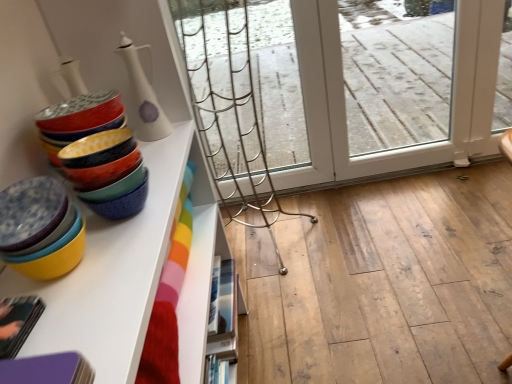
Question: Is white glossy vase at upper left, which ranks as the first tableware in top-to-bottom order, aimed at white glossy bookshelf at lower center?

Choices:
 (A) no
 (B) yes

Answer: (A)

Question: Does white glossy vase at upper left, which ranks as the first tableware in top-to-bottom order, have a larger size compared to white glossy bookshelf at lower center?

Choices:
 (A) yes
 (B) no

Answer: (B)

Question: From a real-world perspective, does white glossy vase at upper left, the 2th tableware when ordered from bottom to top, sit lower than white glossy bookshelf at lower center?

Choices:
 (A) yes
 (B) no

Answer: (B)

Question: Would you say white glossy bookshelf at lower center is part of white glossy vase at upper left, the 2th tableware when ordered from bottom to top,'s contents?

Choices:
 (A) no
 (B) yes

Answer: (A)

Question: From the image's perspective, does white glossy vase at upper left, which ranks as the first tableware in top-to-bottom order, appear higher than white glossy bookshelf at lower center?

Choices:
 (A) no
 (B) yes

Answer: (B)

Question: Considering the positions of matte ceramic bowls at left, which appears as the 2th tableware when viewed from the top, and matte ceramic bowls at left in the image, is matte ceramic bowls at left, which appears as the 2th tableware when viewed from the top, wider or thinner than matte ceramic bowls at left?

Choices:
 (A) wide
 (B) thin

Answer: (A)

Question: From their relative heights in the image, would you say matte ceramic bowls at left, which appears as the 2th tableware when viewed from the top, is taller or shorter than matte ceramic bowls at left?

Choices:
 (A) tall
 (B) short

Answer: (A)

Question: Which is correct: matte ceramic bowls at left, which appears as the 2th tableware when viewed from the top, is inside matte ceramic bowls at left, or outside of it?

Choices:
 (A) outside
 (B) inside

Answer: (A)

Question: In the image, is matte ceramic bowls at left, positioned as the second tableware in back-to-front order, on the left side or the right side of matte ceramic bowls at left?

Choices:
 (A) right
 (B) left

Answer: (A)

Question: From a real-world perspective, is matte ceramic bowls at left, positioned as the second tableware in back-to-front order, positioned above or below white glossy vase at upper left, which ranks as the first tableware in top-to-bottom order?

Choices:
 (A) below
 (B) above

Answer: (A)

Question: From the image's perspective, is matte ceramic bowls at left, which is the 1th tableware in front-to-back order, located above or below white glossy vase at upper left, the 2th tableware when ordered from bottom to top?

Choices:
 (A) below
 (B) above

Answer: (A)

Question: Is matte ceramic bowls at left, which is the 1th tableware in front-to-back order, wider or thinner than white glossy vase at upper left, placed as the first tableware when sorted from back to front?

Choices:
 (A) thin
 (B) wide

Answer: (B)

Question: Considering their positions, is matte ceramic bowls at left, positioned as the second tableware in back-to-front order, located in front of or behind white glossy vase at upper left, the 2th tableware when ordered from bottom to top?

Choices:
 (A) behind
 (B) front

Answer: (B)

Question: Looking at the image, does white glossy vase at upper left, placed as the first tableware when sorted from back to front, seem bigger or smaller compared to white glossy bookshelf at lower center?

Choices:
 (A) small
 (B) big

Answer: (A)

Question: Is white glossy vase at upper left, placed as the first tableware when sorted from back to front, taller or shorter than white glossy bookshelf at lower center?

Choices:
 (A) short
 (B) tall

Answer: (B)